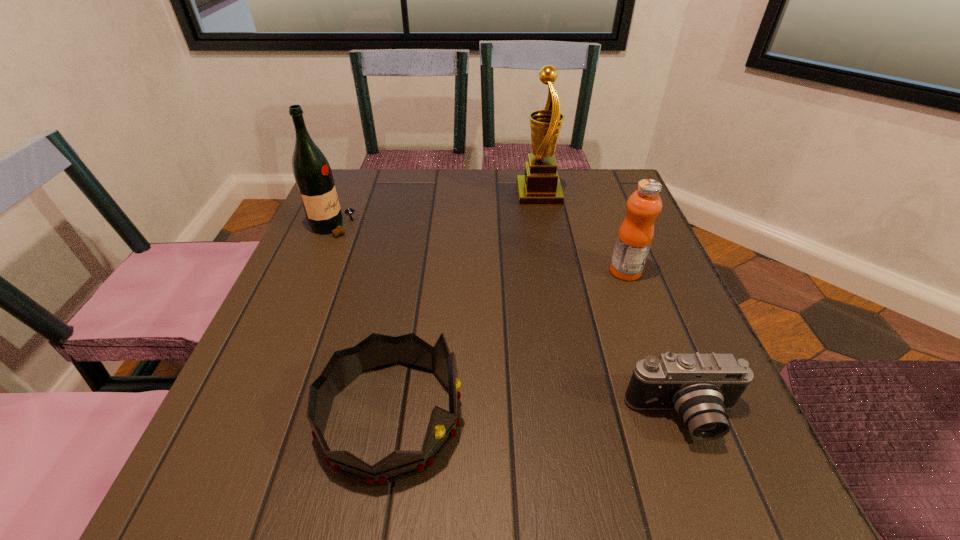
The image size is (960, 540). Identify the location of tiara that is positioned at the left edge. (376, 351).

Locate an element on the screen. fruit juice located in the right edge section of the desktop is located at coordinates (643, 206).

Locate an element on the screen. camera located in the right edge section of the desktop is located at coordinates (700, 387).

The height and width of the screenshot is (540, 960). Find the location of `object located at the far left corner`. object located at the far left corner is located at coordinates (311, 170).

Where is `object that is at the near left corner`? object that is at the near left corner is located at coordinates (376, 351).

Locate an element on the screen. vacant space at the far edge of the desktop is located at coordinates (488, 207).

Where is `blank space at the near edge`? The height and width of the screenshot is (540, 960). blank space at the near edge is located at coordinates (436, 489).

Find the location of a particular element. vacant area at the left edge of the desktop is located at coordinates (321, 295).

Identify the location of vacant space at the right edge. (619, 313).

The height and width of the screenshot is (540, 960). In order to click on blank space at the far left corner of the desktop in this screenshot , I will do `click(373, 188)`.